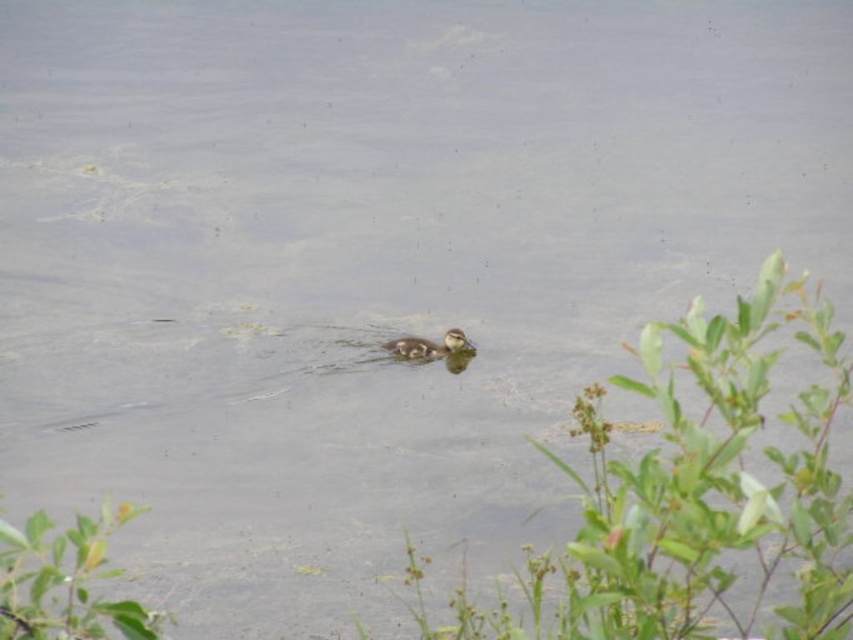
Question: From the image, what is the correct spatial relationship of green leafy plant at center in relation to brown fuzzy duckling at center?

Choices:
 (A) above
 (B) below

Answer: (B)

Question: Which of the following is the closest to the observer?

Choices:
 (A) (33, 568)
 (B) (404, 349)

Answer: (A)

Question: Which point is closer to the camera taking this photo?

Choices:
 (A) (746, 314)
 (B) (85, 580)

Answer: (A)

Question: Can you confirm if green leafy plant at lower left is thinner than brown fuzzy duckling at center?

Choices:
 (A) yes
 (B) no

Answer: (B)

Question: Which is farther from the green leafy plant at center?

Choices:
 (A) brown fuzzy duckling at center
 (B) green leafy plant at lower left

Answer: (A)

Question: Does green leafy plant at center have a greater width compared to green leafy plant at lower left?

Choices:
 (A) no
 (B) yes

Answer: (B)